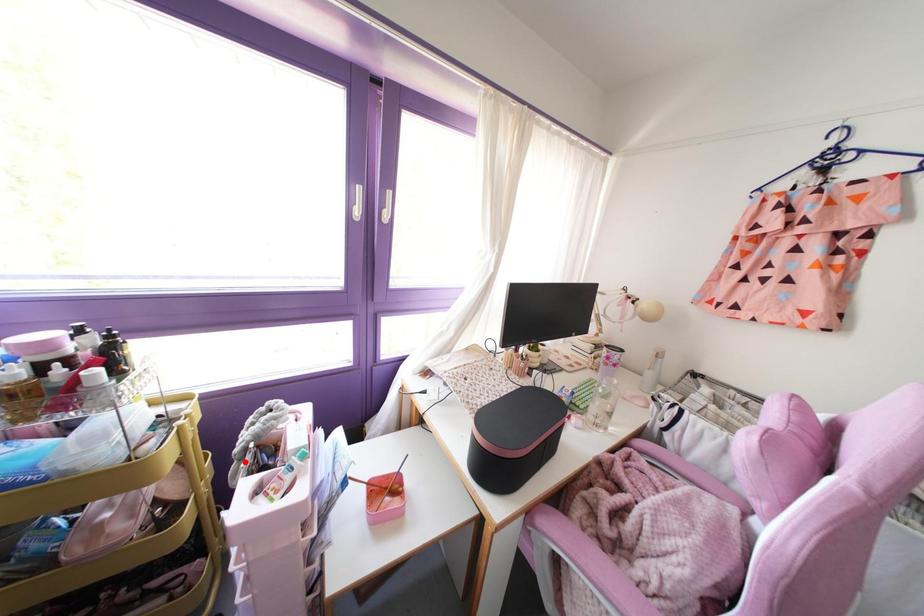
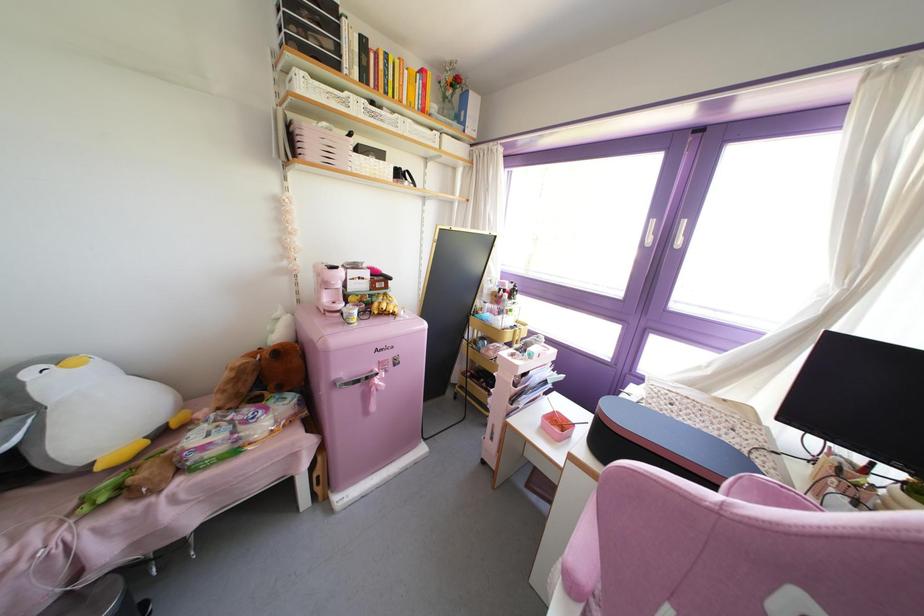
The point at the highlighted location is marked in the first image. Where is the corresponding point in the second image?

(516, 345)